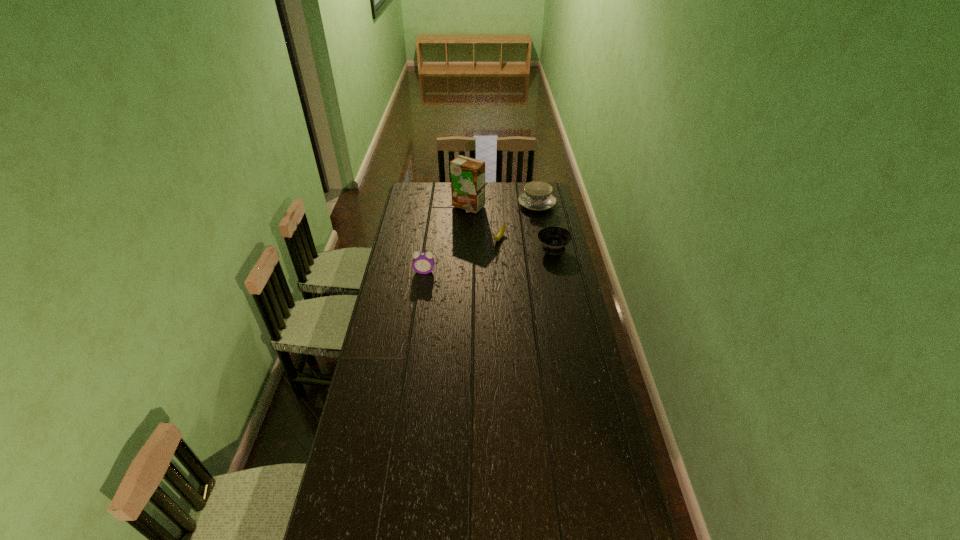
Where is `free space on the desktop that is between the leftmost object and the bowl and is positioned with the handle on the side of the chinaware`? The width and height of the screenshot is (960, 540). free space on the desktop that is between the leftmost object and the bowl and is positioned with the handle on the side of the chinaware is located at coordinates (477, 262).

You are a GUI agent. You are given a task and a screenshot of the screen. Output one action in this format:
    pyautogui.click(x=<x>, y=<y>)
    Task: Click on the free space on the desktop that is between the leftmost object and the bowl and is positioned on the straw side of the tallest object
    This screenshot has width=960, height=540.
    Given the screenshot: What is the action you would take?
    pyautogui.click(x=486, y=260)

Where is `free space on the desktop that is between the leftmost object and the bowl and is positioned at the stem of the banana`? free space on the desktop that is between the leftmost object and the bowl and is positioned at the stem of the banana is located at coordinates (484, 261).